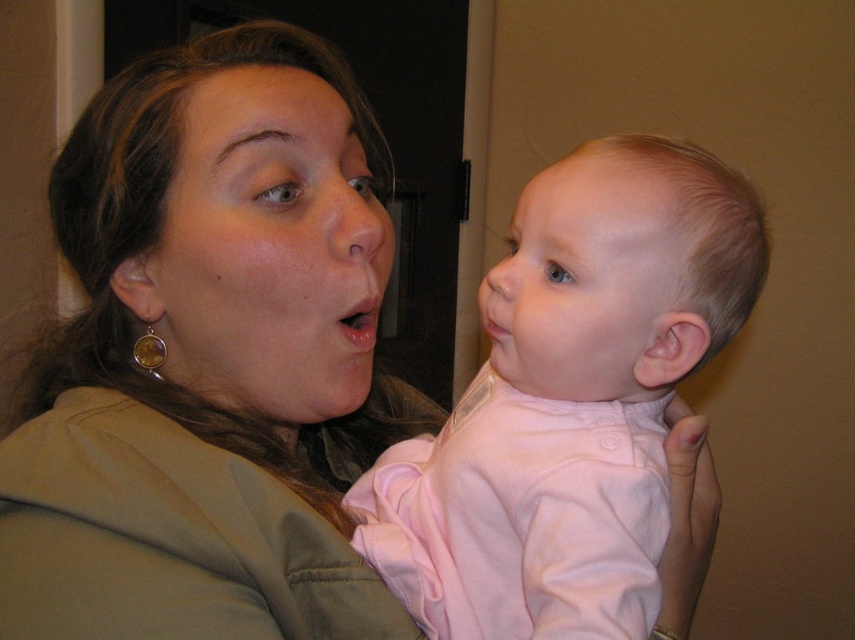
Question: Which point is farther to the camera?

Choices:
 (A) (370, 328)
 (B) (151, 502)
 (C) (605, 284)

Answer: (A)

Question: Which object is the closest to the matte green jacket at upper left?

Choices:
 (A) pink fabric baby at center
 (B) matte pink lips at center

Answer: (A)

Question: Which of the following is the farthest from the observer?

Choices:
 (A) matte green jacket at upper left
 (B) pink fabric baby at center

Answer: (B)

Question: In this image, where is matte green jacket at upper left located relative to matte pink lips at center?

Choices:
 (A) below
 (B) above

Answer: (A)

Question: Is matte green jacket at upper left further to camera compared to pink fabric baby at center?

Choices:
 (A) no
 (B) yes

Answer: (A)

Question: Considering the relative positions of matte green jacket at upper left and matte pink lips at center in the image provided, where is matte green jacket at upper left located with respect to matte pink lips at center?

Choices:
 (A) left
 (B) right

Answer: (A)